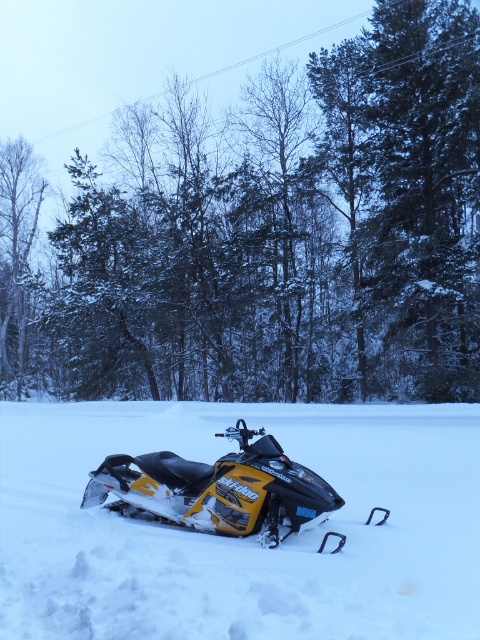
Does snow-covered evergreen tree at center lie in front of yellow matte snowmobile at center?

That is False.

Does point (14, 173) come behind point (120, 508)?

Yes, it is behind point (120, 508).

Between point (152, 388) and point (162, 516), which one is positioned in front?

Point (162, 516) is more forward.

This screenshot has width=480, height=640. Find the location of `snow-covered evergreen tree at center`. snow-covered evergreen tree at center is located at coordinates (264, 234).

Between yellow plastic snowmobile at center and yellow matte snowmobile at center, which one is positioned lower?

yellow plastic snowmobile at center

Is point (1, 616) positioned after point (231, 461)?

No, (1, 616) is in front of (231, 461).

At what (x,y) coordinates should I click in order to perform the action: click on yellow plastic snowmobile at center. Please return your answer as a coordinate pair (x, y). The height and width of the screenshot is (640, 480). Looking at the image, I should click on (240, 538).

Between yellow plastic snowmobile at center and smooth white tree at left, which one has more height?

With more height is smooth white tree at left.

Looking at this image, is yellow plastic snowmobile at center taller than smooth white tree at left?

No, yellow plastic snowmobile at center is not taller than smooth white tree at left.

This screenshot has width=480, height=640. What do you see at coordinates (240, 538) in the screenshot?
I see `yellow plastic snowmobile at center` at bounding box center [240, 538].

Find the location of `yellow plastic snowmobile at center`. yellow plastic snowmobile at center is located at coordinates (240, 538).